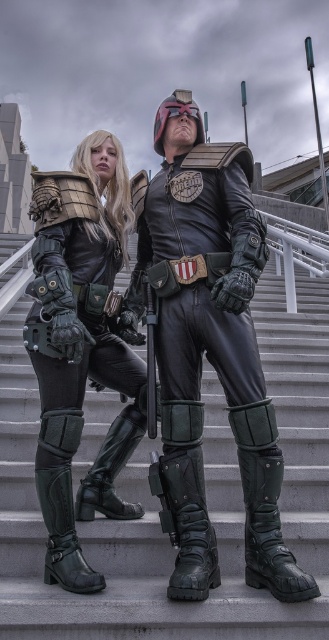
Which is below, black leather boot at lower center or green matte boots at lower center?

black leather boot at lower center

Does black leather boot at lower center appear on the right side of green matte boots at lower center?

Yes, black leather boot at lower center is to the right of green matte boots at lower center.

Locate an element on the screen. black leather boot at lower center is located at coordinates click(185, 522).

Between gray concrete stairs at center and leather/metallic armor at center, which one appears on the right side from the viewer's perspective?

gray concrete stairs at center is more to the right.

Is gray concrete stairs at center wider than leather/metallic armor at center?

In fact, gray concrete stairs at center might be narrower than leather/metallic armor at center.

Is point (324, 492) positioned after point (267, 572)?

Yes, it is behind point (267, 572).

Image resolution: width=329 pixels, height=640 pixels. Identify the location of gray concrete stairs at center. (157, 502).

The width and height of the screenshot is (329, 640). Describe the element at coordinates (80, 348) in the screenshot. I see `matte black armor at center` at that location.

The height and width of the screenshot is (640, 329). What do you see at coordinates (80, 348) in the screenshot?
I see `matte black armor at center` at bounding box center [80, 348].

Identify the location of matte black armor at center. The height and width of the screenshot is (640, 329). (80, 348).